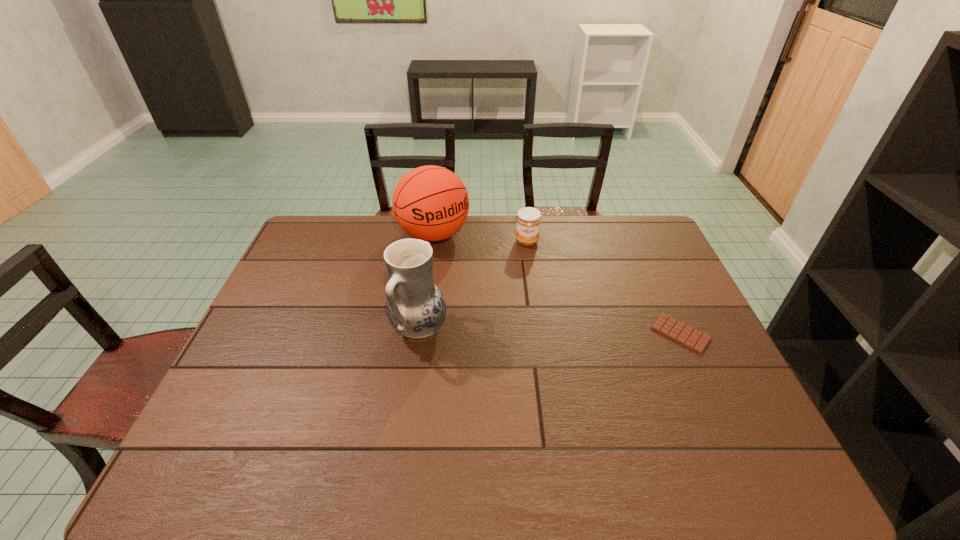
The width and height of the screenshot is (960, 540). In order to click on pottery in this screenshot , I will do `click(416, 308)`.

The image size is (960, 540). In order to click on candy bar in this screenshot , I will do `click(694, 339)`.

Identify the location of the rightmost object. This screenshot has width=960, height=540. (694, 339).

This screenshot has width=960, height=540. I want to click on the third object from left to right, so click(528, 223).

Image resolution: width=960 pixels, height=540 pixels. I want to click on jam, so pyautogui.click(x=528, y=223).

The height and width of the screenshot is (540, 960). I want to click on basketball, so click(430, 203).

Image resolution: width=960 pixels, height=540 pixels. Find the location of `free space located 0.220m on the front of the pottery`. free space located 0.220m on the front of the pottery is located at coordinates (406, 432).

This screenshot has width=960, height=540. Identify the location of vacant point located 0.210m on the left of the shortest object. (579, 333).

Where is `vacant region located on the front label of the third object from left to right`? The image size is (960, 540). vacant region located on the front label of the third object from left to right is located at coordinates (526, 258).

You are a GUI agent. You are given a task and a screenshot of the screen. Output one action in this format:
    pyautogui.click(x=<x>, y=<y>)
    Task: Click on the free space located 0.290m on the front label of the third object from left to right
    
    Given the screenshot: What is the action you would take?
    [524, 307]